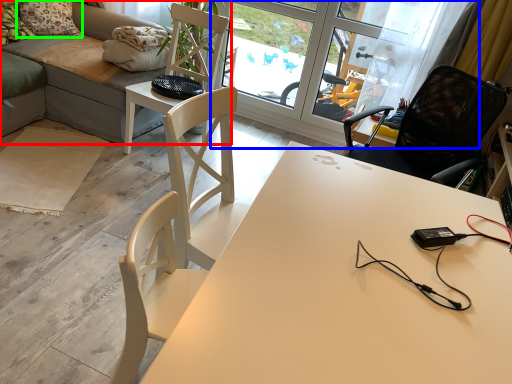
Question: Which is farther away from studio couch (highlighted by a red box)? screen door (highlighted by a blue box) or pillow (highlighted by a green box)?

Choices:
 (A) screen door
 (B) pillow

Answer: (A)